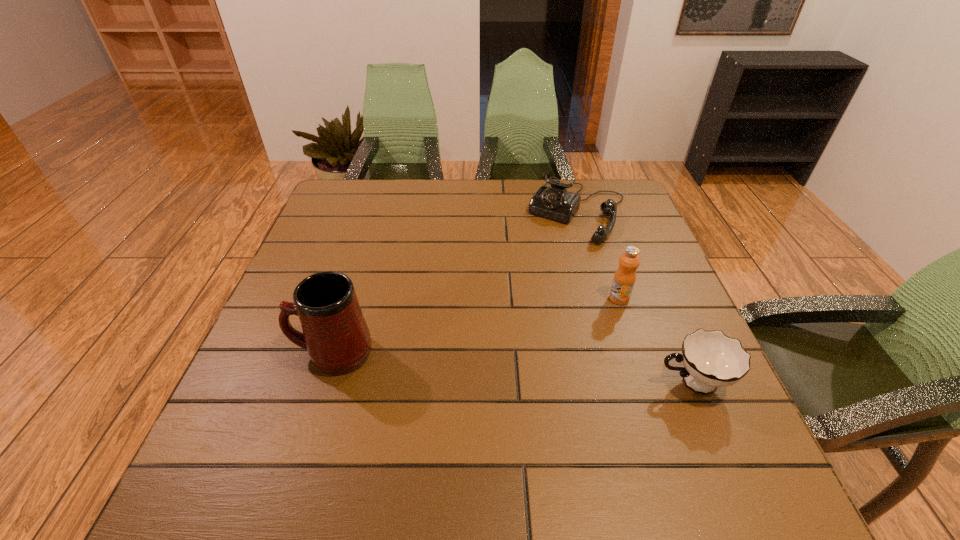
Where is `the tallest object`? Image resolution: width=960 pixels, height=540 pixels. the tallest object is located at coordinates (335, 334).

At what (x,y) coordinates should I click in order to perform the action: click on mug. Please return your answer as a coordinate pair (x, y). This screenshot has height=540, width=960. Looking at the image, I should click on (x=335, y=334).

The width and height of the screenshot is (960, 540). I want to click on cup, so click(x=711, y=359).

Image resolution: width=960 pixels, height=540 pixels. Find the location of `the second tallest object`. the second tallest object is located at coordinates (625, 276).

Find the location of a particular element. The image size is (960, 540). the second farthest object is located at coordinates click(x=625, y=276).

I want to click on telephone, so click(555, 202).

This screenshot has height=540, width=960. Identify the location of free space located 0.070m on the side of the tallest object with the handle. (259, 353).

Locate an element on the screen. The image size is (960, 540). vacant space located on the side of the tallest object with the handle is located at coordinates (269, 353).

Image resolution: width=960 pixels, height=540 pixels. Find the location of `free space located on the side of the tallest object with the handle`. free space located on the side of the tallest object with the handle is located at coordinates point(269,353).

Identify the location of free location located 0.100m on the side of the cup with the handle. (605, 383).